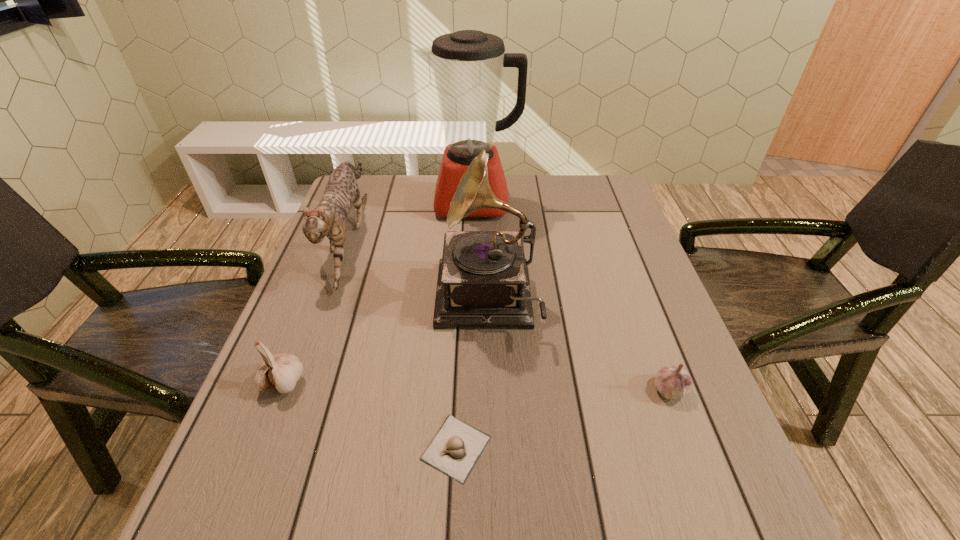
Where is `vacant region between the tallest garlic and the tallest object`? vacant region between the tallest garlic and the tallest object is located at coordinates (378, 292).

Find the location of a particular element. The height and width of the screenshot is (540, 960). free space between the third tallest object and the blender is located at coordinates click(411, 219).

Where is `free spot between the blender and the tallest garlic`? The height and width of the screenshot is (540, 960). free spot between the blender and the tallest garlic is located at coordinates point(378,292).

Find the location of a particular element. vacant area between the cat and the nearest object is located at coordinates (402, 342).

Where is `vacant space in between the shortest garlic and the second tallest object`? The image size is (960, 540). vacant space in between the shortest garlic and the second tallest object is located at coordinates (471, 375).

You are a GUI agent. You are given a task and a screenshot of the screen. Output one action in this format:
    pyautogui.click(x=<x>, y=<y>)
    Task: Click on the free space that is in between the second shortest object and the blender
    
    Given the screenshot: What is the action you would take?
    pyautogui.click(x=571, y=296)

Locate an element on the screen. vacant space that's between the cat and the tallest object is located at coordinates (411, 219).

This screenshot has width=960, height=540. I want to click on vacant area that lies between the cat and the third shortest object, so pyautogui.click(x=316, y=309).

Identify which object is located as the second nearest to the fourth tallest object. Please provide its 2D coordinates. Your answer should be formatted as a tuple, i.e. [(x, y)], where the tuple contains the x and y coordinates of a point satisfying the conditions above.

[(455, 449)]

Select which object appears as the fifth closest to the second shortest garlic. Please provide its 2D coordinates. Your answer should be formatted as a tuple, i.e. [(x, y)], where the tuple contains the x and y coordinates of a point satisfying the conditions above.

[(328, 219)]